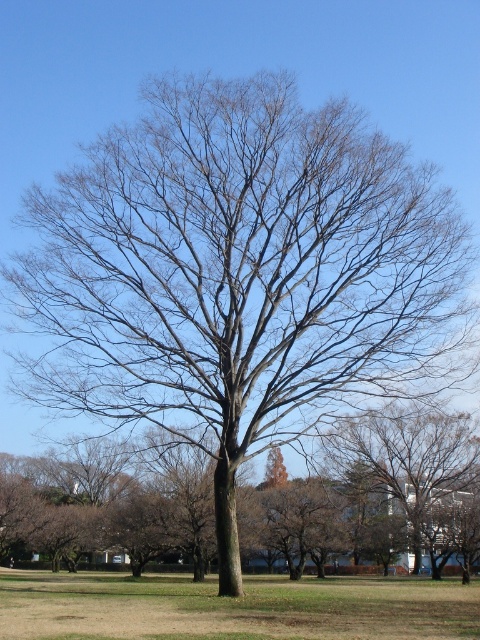
Question: Is green grass at center bigger than bare branches at center?

Choices:
 (A) no
 (B) yes

Answer: (B)

Question: Is green grass at center wider than bare branches at center?

Choices:
 (A) yes
 (B) no

Answer: (A)

Question: Among these points, which one is nearest to the camera?

Choices:
 (A) tap(359, 440)
 (B) tap(434, 621)

Answer: (B)

Question: Does green grass at center come behind bare branches at center?

Choices:
 (A) yes
 (B) no

Answer: (B)